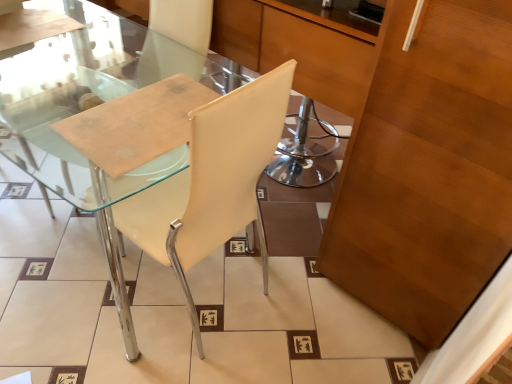
At what (x,y) coordinates should I click in order to perform the action: click on vacant area that is situated to the right of white leather chair at center. Please return your answer as a coordinate pair (x, y). The image size is (512, 384). Looking at the image, I should click on (292, 327).